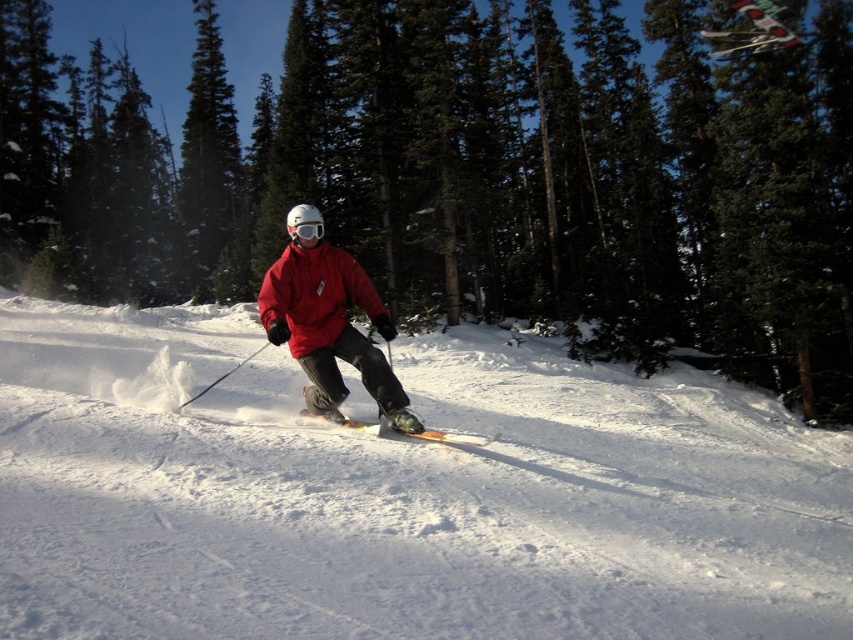
Question: Which object is closer to the camera taking this photo?

Choices:
 (A) white matte goggles at center
 (B) green textured pine tree at center

Answer: (A)

Question: Estimate the real-world distances between objects in this image. Which object is closer to the matte red jacket at center?

Choices:
 (A) white matte goggles at center
 (B) orange metallic ski at center
 (C) white powdery snow at center

Answer: (A)

Question: Estimate the real-world distances between objects in this image. Which object is farther from the green textured pine tree at center?

Choices:
 (A) orange metallic ski at center
 (B) white powdery snow at center

Answer: (A)

Question: Is white powdery snow at center above white matte goggles at center?

Choices:
 (A) no
 (B) yes

Answer: (A)

Question: Is matte red jacket at center wider than white matte goggles at center?

Choices:
 (A) yes
 (B) no

Answer: (A)

Question: Is white powdery snow at center above matte red jacket at center?

Choices:
 (A) no
 (B) yes

Answer: (A)